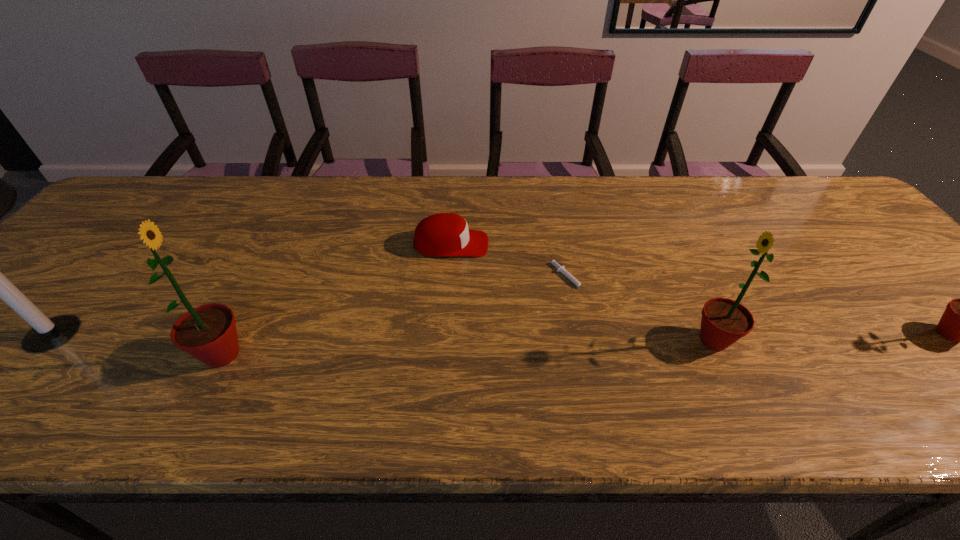
Where is `the leftmost sunflower`? The height and width of the screenshot is (540, 960). the leftmost sunflower is located at coordinates (208, 333).

You are a GUI agent. You are given a task and a screenshot of the screen. Output one action in this format:
    pyautogui.click(x=<x>, y=<y>)
    Task: Click on the third tallest object
    The height and width of the screenshot is (540, 960).
    Given the screenshot: What is the action you would take?
    pyautogui.click(x=724, y=321)

Locate an element on the screen. This screenshot has height=540, width=960. the second object from right to left is located at coordinates (724, 321).

Where is `the farthest object`? Image resolution: width=960 pixels, height=540 pixels. the farthest object is located at coordinates (444, 234).

Identify the location of the third object from left to right. (444, 234).

The image size is (960, 540). In order to click on syringe in this screenshot , I will do `click(561, 269)`.

Locate an element on the screen. Image resolution: width=960 pixels, height=540 pixels. the third object from right to left is located at coordinates (561, 269).

Locate an element on the screen. vacant space located on the face of the fifth object from right to left is located at coordinates (312, 355).

In order to click on vacant space located 0.220m on the face of the second tallest sunflower in this screenshot , I will do `click(589, 340)`.

Image resolution: width=960 pixels, height=540 pixels. What are the coordinates of `vacant space situated on the face of the second tallest sunflower` in the screenshot? It's located at (593, 340).